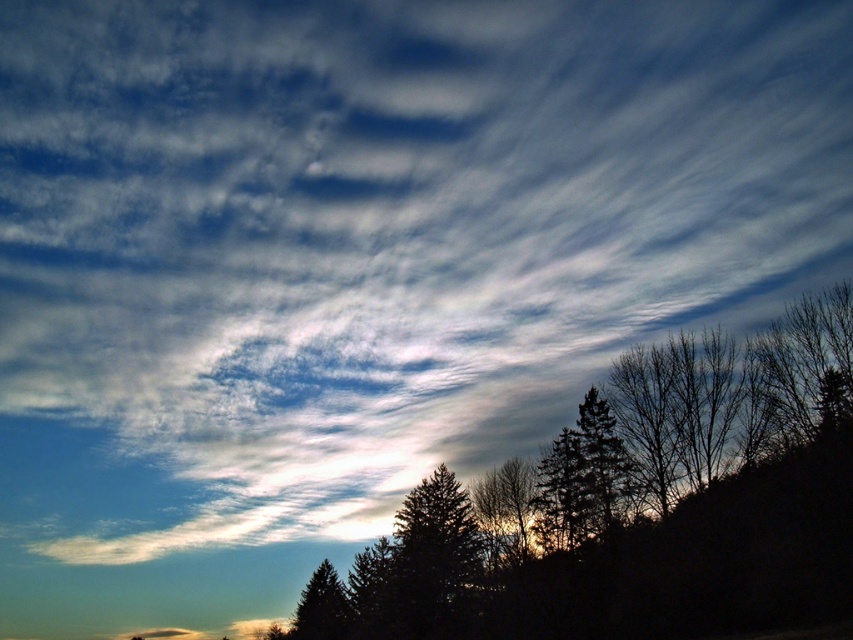
Question: Which point appears farthest from the camera in this image?

Choices:
 (A) (587, 449)
 (B) (614, 461)

Answer: (A)

Question: Is silhouette evergreen tree at center wider than green matte tree at lower center?

Choices:
 (A) no
 (B) yes

Answer: (B)

Question: Is dark green textured tree at center wider than green matte tree at lower center?

Choices:
 (A) no
 (B) yes

Answer: (A)

Question: Which point is closer to the camera?

Choices:
 (A) (537, 524)
 (B) (576, 420)

Answer: (B)

Question: Can you confirm if silhouette evergreen tree at center is bigger than dark green textured tree at center?

Choices:
 (A) no
 (B) yes

Answer: (B)

Question: Which object is farther from the camera taking this photo?

Choices:
 (A) dark green textured tree at center
 (B) silhouette evergreen tree at center

Answer: (A)